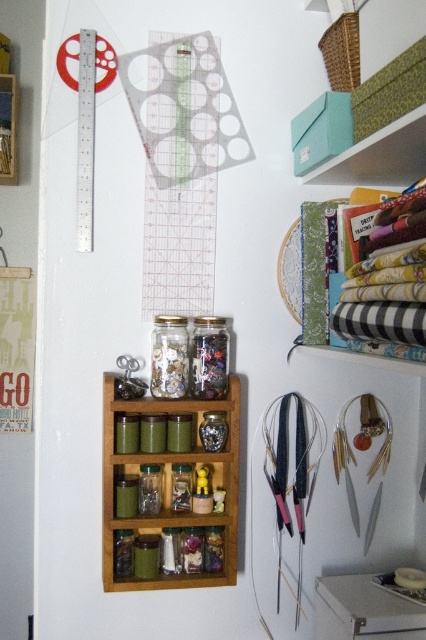
Question: Is transparent plastic ruler at upper left wider than clear glass jar at center?

Choices:
 (A) no
 (B) yes

Answer: (A)

Question: Can you confirm if transparent plastic ruler at upper left is positioned to the right of wooden spice rack at upper left?

Choices:
 (A) no
 (B) yes

Answer: (B)

Question: Which is nearer to the transparent plastic ruler at upper left?

Choices:
 (A) transparent glass jar at center
 (B) clear glass jar at center
 (C) wooden spice rack at upper left

Answer: (A)

Question: Based on their relative distances, which object is farther from the clear glass jar at center?

Choices:
 (A) transparent glass jar at center
 (B) wooden spice rack at center
 (C) wooden spice rack at upper left

Answer: (C)

Question: In this image, where is wooden spice rack at center located relative to transparent plastic ruler at upper left?

Choices:
 (A) below
 (B) above

Answer: (A)

Question: Which point is farther to the camera?

Choices:
 (A) wooden spice rack at upper left
 (B) clear glass jar at center

Answer: (A)